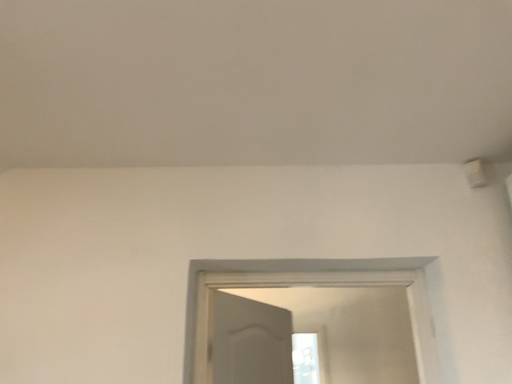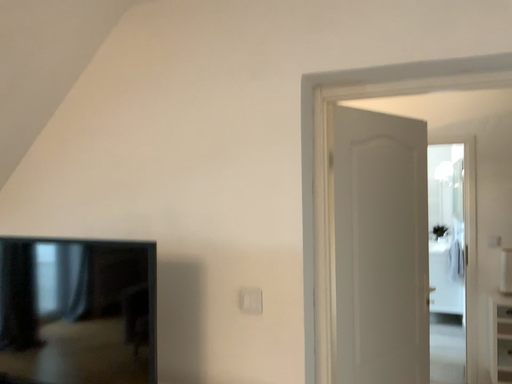
Question: How did the camera likely rotate when shooting the video?

Choices:
 (A) rotated upward
 (B) rotated downward

Answer: (B)